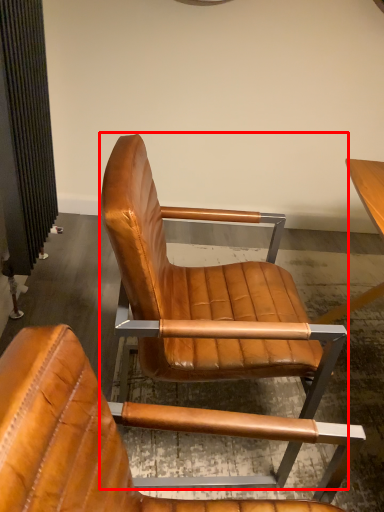
Question: From the image, what is the correct spatial relationship of chair (annotated by the red box) in relation to chair?

Choices:
 (A) right
 (B) left

Answer: (A)